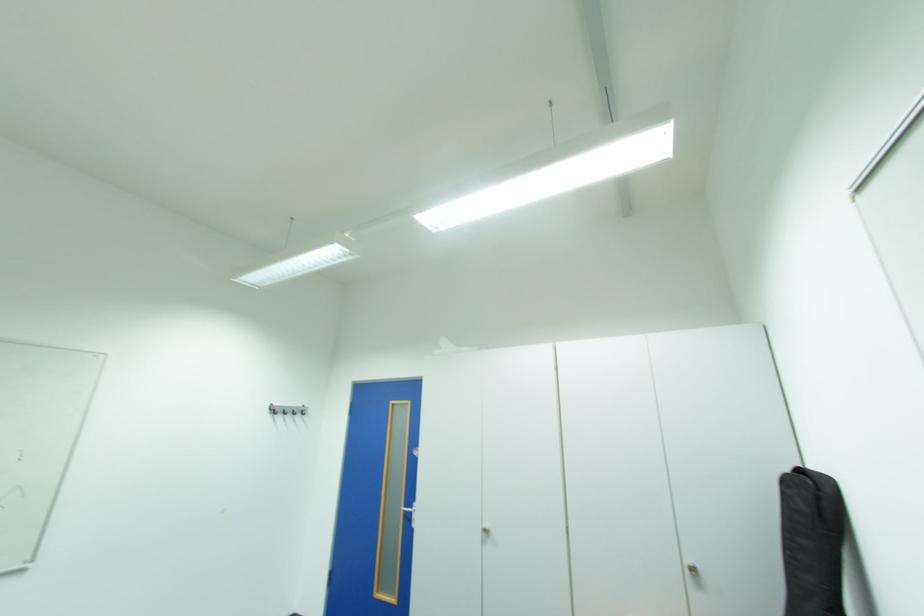
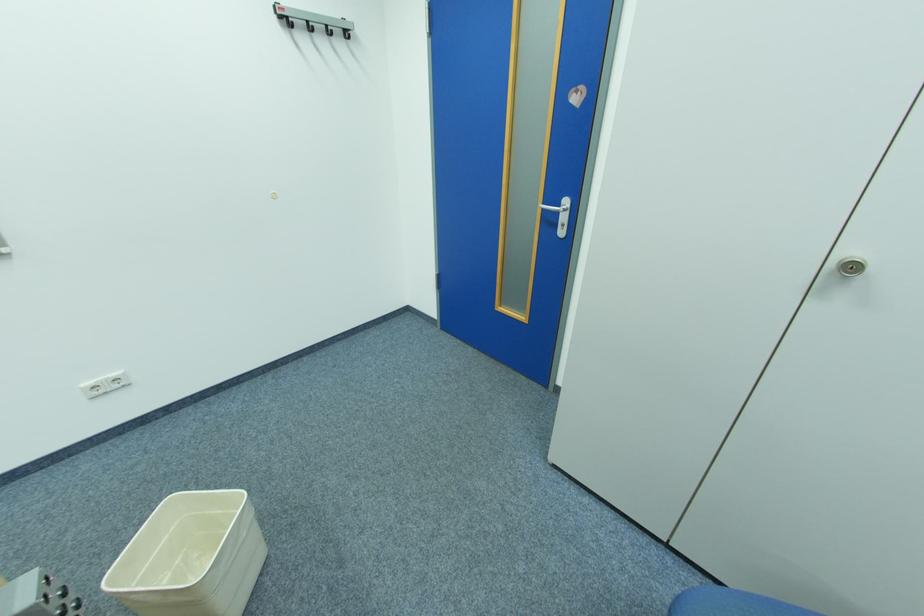
Where in the second image is the point corresponding to [280,411] from the first image?

(290, 25)